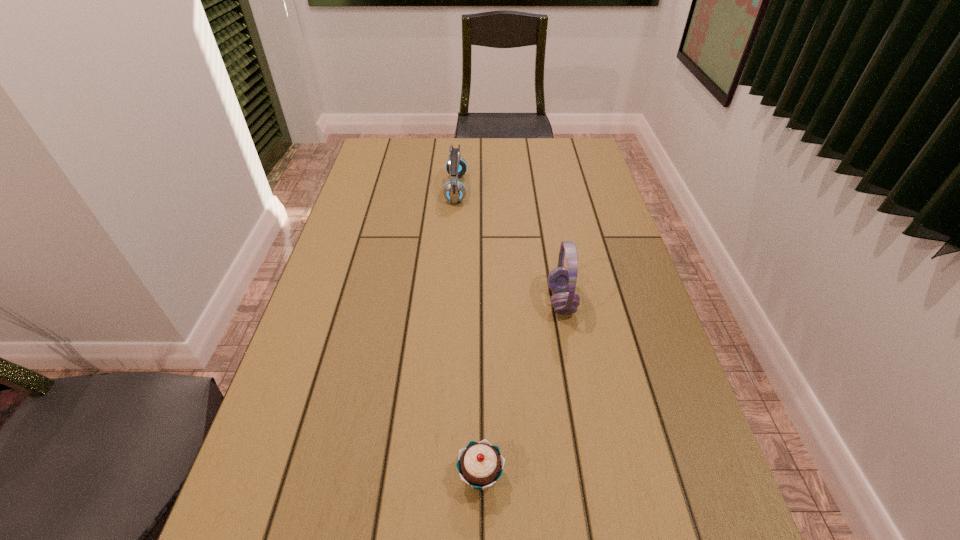
This screenshot has width=960, height=540. Find the location of `vacant area located 0.210m on the left of the nearest object`. vacant area located 0.210m on the left of the nearest object is located at coordinates (340, 476).

Locate an element on the screen. The height and width of the screenshot is (540, 960). free space at the far edge is located at coordinates (486, 168).

The height and width of the screenshot is (540, 960). Identify the location of vacant space at the left edge. (352, 262).

This screenshot has width=960, height=540. I want to click on free space at the right edge, so click(603, 360).

The height and width of the screenshot is (540, 960). I want to click on vacant area at the far left corner, so click(x=365, y=168).

Find the location of a particular element. vacant space at the far right corner of the desktop is located at coordinates pyautogui.click(x=558, y=171).

Locate an element on the screen. Image resolution: width=960 pixels, height=540 pixels. vacant area between the shortest object and the taller headset is located at coordinates (521, 388).

Where is `empty space that is in between the shortest object and the leftmost object`? The width and height of the screenshot is (960, 540). empty space that is in between the shortest object and the leftmost object is located at coordinates (468, 333).

Where is `vacant area that lies between the rightmost object and the second object from left to right`? vacant area that lies between the rightmost object and the second object from left to right is located at coordinates (521, 388).

Where is `vacant space in between the tallest object and the cupcake`? The height and width of the screenshot is (540, 960). vacant space in between the tallest object and the cupcake is located at coordinates (521, 388).